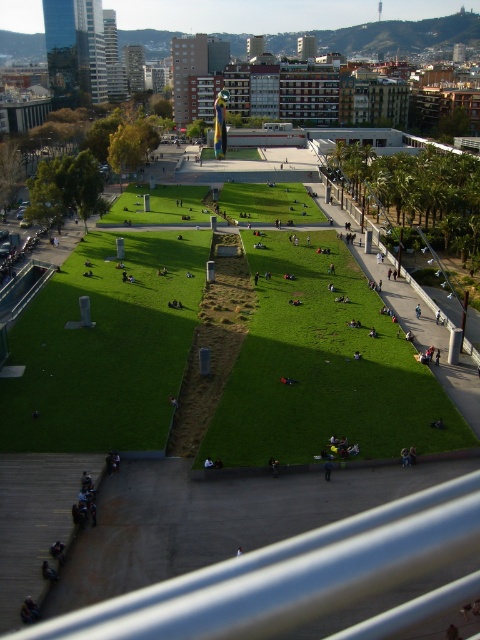
Does dark blue jacket at lower center lie behind smooth black shirt at center?

Yes, dark blue jacket at lower center is behind smooth black shirt at center.

What do you see at coordinates (327, 468) in the screenshot?
I see `dark blue jacket at lower center` at bounding box center [327, 468].

Image resolution: width=480 pixels, height=640 pixels. I want to click on dark blue jacket at lower center, so click(x=327, y=468).